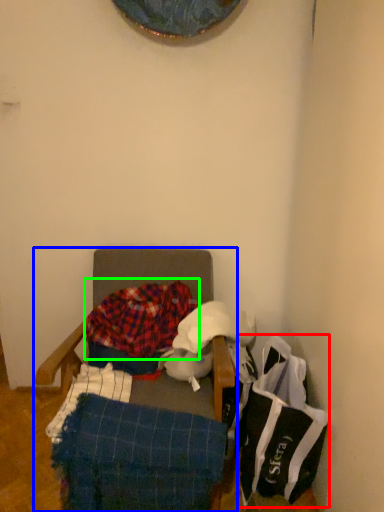
Question: Estimate the real-world distances between objects in this image. Which object is closer to material (highlighted by a red box), furniture (highlighted by a blue box) or blanket (highlighted by a green box)?

Choices:
 (A) furniture
 (B) blanket

Answer: (B)